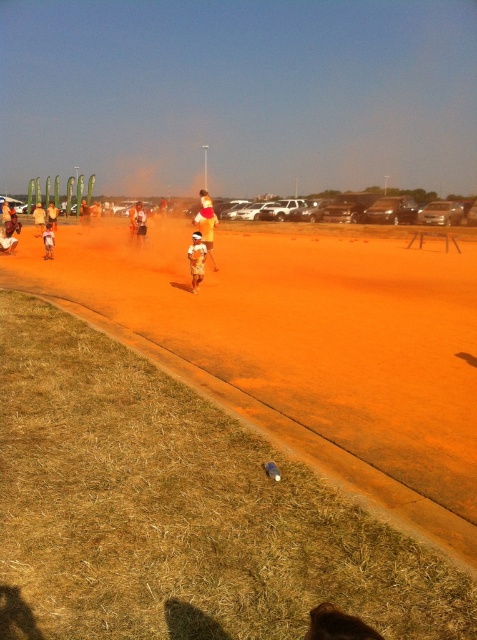
Is yellow fabric shirt at center in front of orange fabric shorts at center?

No, it is behind orange fabric shorts at center.

Who is shorter, yellow fabric shirt at center or orange fabric shorts at center?

Standing shorter between the two is orange fabric shorts at center.

Which is in front, point (196, 218) or point (198, 276)?

Point (198, 276)

Locate an element on the screen. The image size is (477, 640). yellow fabric shirt at center is located at coordinates (206, 220).

Between orange cotton shirt at center and light brown cotton shorts at center, which one is positioned higher?

orange cotton shirt at center is higher up.

Can you confirm if orange cotton shirt at center is positioned to the right of light brown cotton shorts at center?

Yes, orange cotton shirt at center is to the right of light brown cotton shorts at center.

Who is more forward, [144,225] or [49,250]?

Point [49,250] is in front.

You are a GUI agent. You are given a task and a screenshot of the screen. Output one action in this format:
    pyautogui.click(x=<x>, y=<y>)
    Task: Click on the orange cotton shirt at center
    This screenshot has width=477, height=640.
    Given the screenshot: What is the action you would take?
    pyautogui.click(x=140, y=224)

Is orange cotton shirt at center below light brown wooden stick at center?

Correct, orange cotton shirt at center is located below light brown wooden stick at center.

Does orange cotton shirt at center have a larger size compared to light brown wooden stick at center?

Actually, orange cotton shirt at center might be smaller than light brown wooden stick at center.

In order to click on orange cotton shirt at center in this screenshot , I will do `click(140, 224)`.